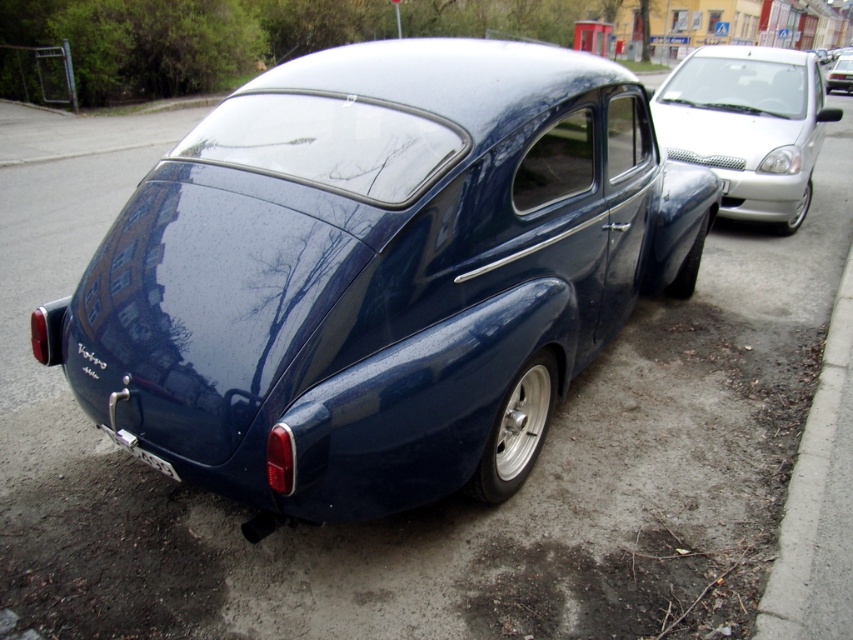
Question: Is matte black bumper at rear below white plastic license plate at lower center?

Choices:
 (A) yes
 (B) no

Answer: (B)

Question: Based on their relative distances, which object is farther from the white plastic license plate at lower center?

Choices:
 (A) glossy blue car at center
 (B) concrete at lower right
 (C) glossy metallic car at center
 (D) white glossy sedan at right

Answer: (C)

Question: Can you confirm if glossy blue car at center is positioned to the left of concrete at lower right?

Choices:
 (A) no
 (B) yes

Answer: (B)

Question: Does glossy blue car at center come in front of concrete at lower right?

Choices:
 (A) no
 (B) yes

Answer: (B)

Question: Which point is closer to the camera taking this photo?

Choices:
 (A) (825, 92)
 (B) (146, 456)

Answer: (B)

Question: Considering the real-world distances, which object is closest to the white glossy sedan at right?

Choices:
 (A) matte black bumper at rear
 (B) glossy blue car at center

Answer: (B)